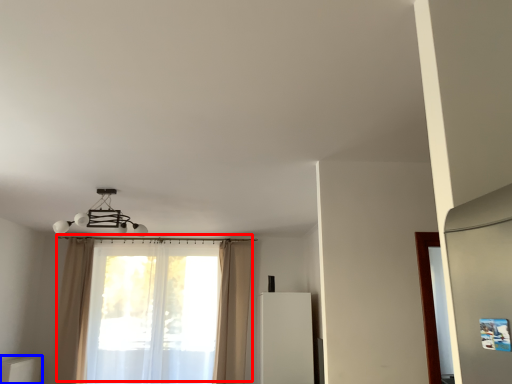
Question: Among these objects, which one is nearest to the camera, curtain (highlighted by a red box) or furniture (highlighted by a blue box)?

Choices:
 (A) curtain
 (B) furniture

Answer: (B)